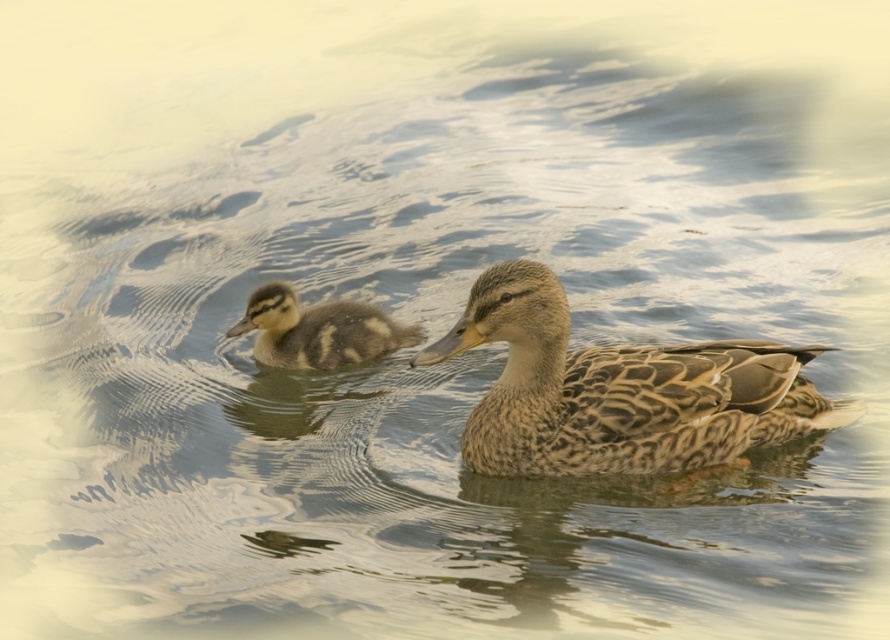
Between brown speckled duck at center and brown speckled duckling at left, which one appears on the left side from the viewer's perspective?

From the viewer's perspective, brown speckled duckling at left appears more on the left side.

Between brown speckled duck at center and brown speckled duckling at left, which one is positioned higher?

brown speckled duckling at left

Locate an element on the screen. The height and width of the screenshot is (640, 890). brown speckled duck at center is located at coordinates (619, 390).